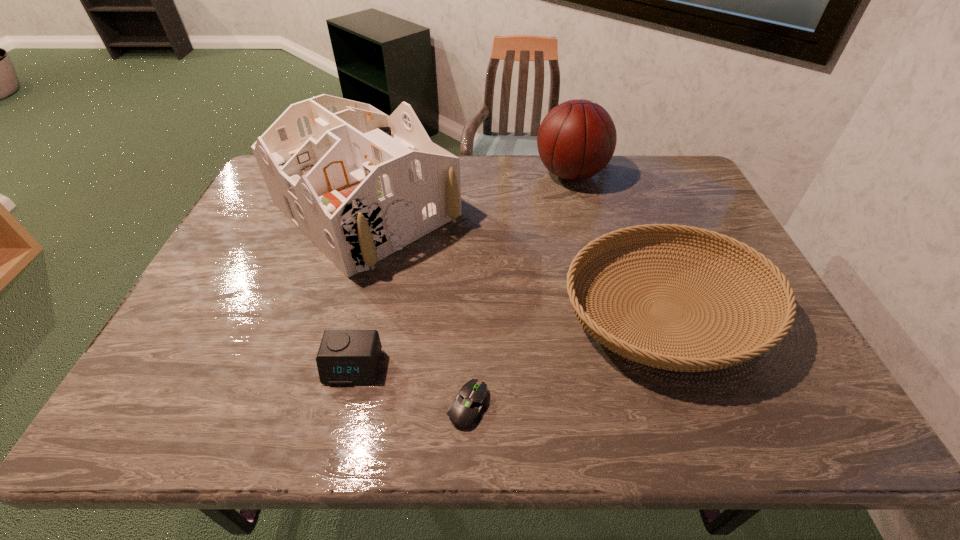
Find the location of a particular element. dollhouse that is at the far edge is located at coordinates (361, 185).

You are a GUI agent. You are given a task and a screenshot of the screen. Output one action in this format:
    pyautogui.click(x=<x>, y=<y>)
    Task: Click on the basketball positioned at the far edge
    The image size is (960, 540).
    Given the screenshot: What is the action you would take?
    pyautogui.click(x=577, y=138)

What are the coordinates of `object at the near edge` in the screenshot? It's located at (466, 409).

Where is `object located in the left edge section of the desktop`? object located in the left edge section of the desktop is located at coordinates (361, 185).

Locate an element on the screen. Image resolution: width=960 pixels, height=540 pixels. object present at the right edge is located at coordinates (711, 358).

Locate an element on the screen. object that is at the far left corner is located at coordinates (361, 185).

The image size is (960, 540). I want to click on vacant area at the far edge of the desktop, so click(x=503, y=174).

Locate an element on the screen. blank area at the near edge is located at coordinates (495, 420).

Where is `vacant space at the right edge`? This screenshot has height=540, width=960. vacant space at the right edge is located at coordinates (670, 219).

I want to click on vacant region at the near left corner of the desktop, so click(x=191, y=396).